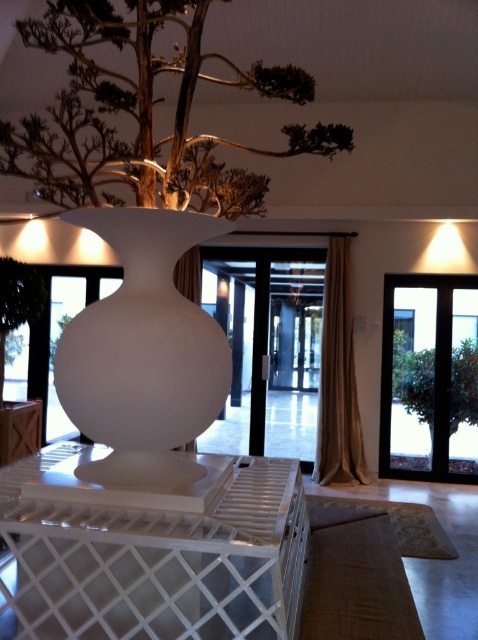
Question: Does white matte tree at center appear on the right side of black glass door at right?

Choices:
 (A) yes
 (B) no

Answer: (B)

Question: Which point is closer to the camera taking this photo?

Choices:
 (A) (186, 150)
 (B) (65, 380)

Answer: (B)

Question: Does wooden textured bonsai tree at upper center appear on the right side of white matte vase at center?

Choices:
 (A) no
 (B) yes

Answer: (A)

Question: Which object is farther from the camera taking this photo?

Choices:
 (A) white matte tree at center
 (B) black glass door at right
 (C) wooden textured bonsai tree at upper center
 (D) white matte vase at center

Answer: (B)

Question: Can you confirm if white matte tree at center is thinner than black glass door at right?

Choices:
 (A) no
 (B) yes

Answer: (A)

Question: Estimate the real-world distances between objects in this image. Which object is farther from the white matte vase at center?

Choices:
 (A) wooden textured bonsai tree at upper center
 (B) black glass door at right

Answer: (B)